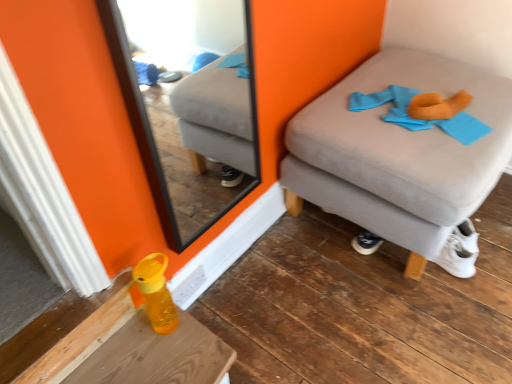
This screenshot has height=384, width=512. Find the location of `unoccupied region to the right of blue fabric at upper right`. unoccupied region to the right of blue fabric at upper right is located at coordinates (483, 101).